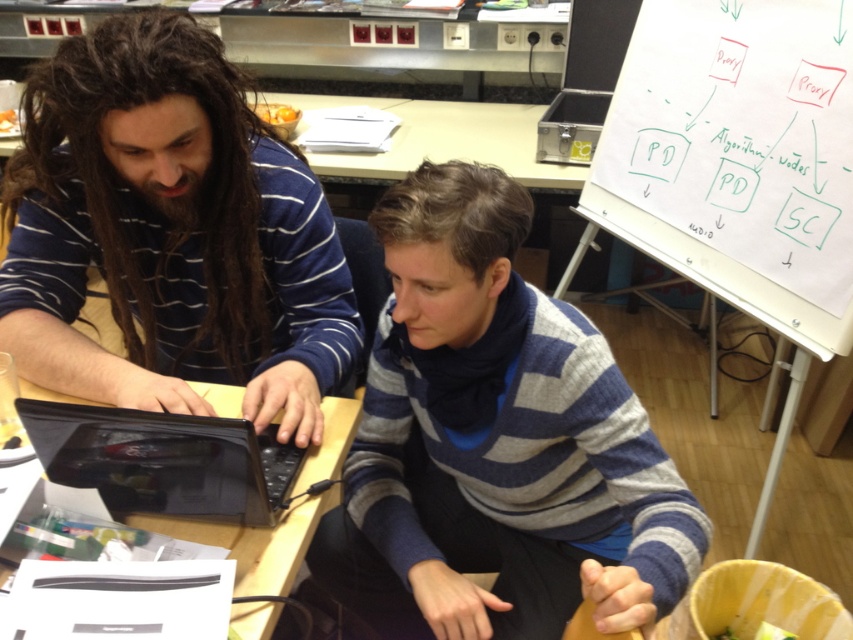
Question: Considering the relative positions of glossy black laptop at center and black plastic laptop at center in the image provided, where is glossy black laptop at center located with respect to black plastic laptop at center?

Choices:
 (A) below
 (B) above

Answer: (B)

Question: Is matte striped sweater at left bigger than glossy black laptop at center?

Choices:
 (A) yes
 (B) no

Answer: (A)

Question: Which of the following is the farthest from the observer?

Choices:
 (A) (602, 433)
 (B) (119, 205)

Answer: (B)

Question: Which point appears farthest from the camera in this image?

Choices:
 (A) (173, 384)
 (B) (86, 451)
 (C) (338, 452)

Answer: (C)

Question: Which point is farther from the camera taking this photo?

Choices:
 (A) (312, 506)
 (B) (64, 451)
 (C) (531, 486)

Answer: (C)

Question: Does matte striped sweater at left appear under glossy black laptop at center?

Choices:
 (A) no
 (B) yes

Answer: (A)